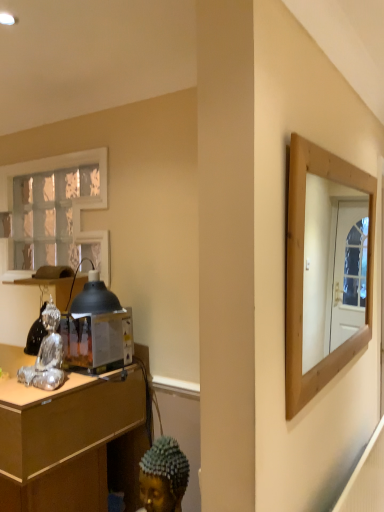
What do you see at coordinates (46, 355) in the screenshot? The height and width of the screenshot is (512, 384). I see `silver metallic figurine at left` at bounding box center [46, 355].

This screenshot has height=512, width=384. Describe the element at coordinates (73, 446) in the screenshot. I see `wooden desk at left` at that location.

This screenshot has height=512, width=384. In order to click on white textured glass at upper left in this screenshot , I will do pos(54,212).

Which is more to the left, white textured glass at upper left or silver metallic figurine at left?

From the viewer's perspective, white textured glass at upper left appears more on the left side.

Considering the positions of objects white textured glass at upper left and silver metallic figurine at left in the image provided, who is behind, white textured glass at upper left or silver metallic figurine at left?

Positioned behind is white textured glass at upper left.

How different are the orientations of white textured glass at upper left and silver metallic figurine at left in degrees?

The angle between the facing direction of white textured glass at upper left and the facing direction of silver metallic figurine at left is 1.42 degrees.

In the scene shown: Is white textured glass at upper left oriented away from silver metallic figurine at left?

No, white textured glass at upper left is not facing the opposite direction of silver metallic figurine at left.

From the image's perspective, is metallic/reflective toaster at left above or below silver metallic figurine at left?

metallic/reflective toaster at left is situated lower than silver metallic figurine at left in the image.

Considering the relative positions of metallic/reflective toaster at left and silver metallic figurine at left in the image provided, is metallic/reflective toaster at left to the left of silver metallic figurine at left from the viewer's perspective?

No.

Does metallic/reflective toaster at left have a lesser width compared to silver metallic figurine at left?

In fact, metallic/reflective toaster at left might be wider than silver metallic figurine at left.

Considering the points (61, 173) and (98, 429), which point is behind, point (61, 173) or point (98, 429)?

Positioned behind is point (61, 173).

Considering the sizes of objects white textured glass at upper left and wooden desk at left in the image provided, who is thinner, white textured glass at upper left or wooden desk at left?

white textured glass at upper left.

Can you see white textured glass at upper left touching wooden desk at left?

No, white textured glass at upper left is not making contact with wooden desk at left.

Is white textured glass at upper left facing towards wooden desk at left?

No.

From a real-world perspective, between metallic/reflective toaster at left and wooden desk at left, who is vertically lower?

wooden desk at left, from a real-world perspective.

Where is `desk in front of the metallic/reflective toaster at left`? This screenshot has width=384, height=512. desk in front of the metallic/reflective toaster at left is located at coordinates (73, 446).

Between metallic/reflective toaster at left and wooden desk at left, which one has larger size?

With larger size is wooden desk at left.

Is wooden desk at left at the back of metallic/reflective toaster at left?

No, metallic/reflective toaster at left is not facing the opposite direction of wooden desk at left.

Is wooden desk at left oriented away from metallic/reflective toaster at left?

No, wooden desk at left is not facing away from metallic/reflective toaster at left.

I want to click on appliance behind the wooden desk at left, so click(x=97, y=340).

From a real-world perspective, between wooden desk at left and metallic/reflective toaster at left, who is vertically lower?

wooden desk at left, from a real-world perspective.

Can we say wooden desk at left lies outside metallic/reflective toaster at left?

Absolutely, wooden desk at left is external to metallic/reflective toaster at left.

Where is `desk lying in front of the white textured glass at upper left`? desk lying in front of the white textured glass at upper left is located at coordinates (73, 446).

From a real-world perspective, is wooden desk at left over white textured glass at upper left?

No.

Is wooden desk at left far away from white textured glass at upper left?

No, wooden desk at left is not far from white textured glass at upper left.

From the image's perspective, is white textured glass at upper left above or below metallic/reflective toaster at left?

white textured glass at upper left is situated higher than metallic/reflective toaster at left in the image.

What's the angular difference between white textured glass at upper left and metallic/reflective toaster at left's facing directions?

There is a 1.71-degree angle between the facing directions of white textured glass at upper left and metallic/reflective toaster at left.

Is white textured glass at upper left directly adjacent to metallic/reflective toaster at left?

white textured glass at upper left is not next to metallic/reflective toaster at left, and they're not touching.

Is white textured glass at upper left smaller than metallic/reflective toaster at left?

No.

At what (x,y) coordinates should I click in order to perform the action: click on window lying behind the silver metallic figurine at left. Please return your answer as a coordinate pair (x, y). The height and width of the screenshot is (512, 384). Looking at the image, I should click on (54, 212).

You are a GUI agent. You are given a task and a screenshot of the screen. Output one action in this format:
    pyautogui.click(x=<x>, y=<y>)
    Task: Click on the figurine that is above the metallic/reflective toaster at left (from a real-world perspective)
    
    Given the screenshot: What is the action you would take?
    pyautogui.click(x=46, y=355)

Considering their positions, is metallic/reflective toaster at left positioned further to white textured glass at upper left than wooden desk at left?

Based on the image, wooden desk at left appears to be further to white textured glass at upper left.

Looking at the image, which one is located closer to silver metallic figurine at left, metallic/reflective toaster at left or white textured glass at upper left?

metallic/reflective toaster at left is positioned closer to the anchor silver metallic figurine at left.

Looking at the image, which one is located further to white textured glass at upper left, silver metallic figurine at left or metallic/reflective toaster at left?

silver metallic figurine at left lies further to white textured glass at upper left than the other object.

Estimate the real-world distances between objects in this image. Which object is further from silver metallic figurine at left, wooden desk at left or metallic/reflective toaster at left?

wooden desk at left is further to silver metallic figurine at left.

Estimate the real-world distances between objects in this image. Which object is closer to wooden desk at left, silver metallic figurine at left or white textured glass at upper left?

silver metallic figurine at left.

Looking at the image, which one is located further to wooden desk at left, metallic/reflective toaster at left or white textured glass at upper left?

white textured glass at upper left.

Estimate the real-world distances between objects in this image. Which object is closer to metallic/reflective toaster at left, silver metallic figurine at left or wooden desk at left?

silver metallic figurine at left is closer to metallic/reflective toaster at left.

Based on their spatial positions, is white textured glass at upper left or wooden desk at left closer to silver metallic figurine at left?

wooden desk at left lies closer to silver metallic figurine at left than the other object.

The image size is (384, 512). I want to click on figurine between white textured glass at upper left and metallic/reflective toaster at left vertically, so click(x=46, y=355).

Image resolution: width=384 pixels, height=512 pixels. Identify the location of figurine between white textured glass at upper left and wooden desk at left from top to bottom. (46, 355).

This screenshot has width=384, height=512. I want to click on figurine located between wooden desk at left and metallic/reflective toaster at left in the left-right direction, so click(x=46, y=355).

The height and width of the screenshot is (512, 384). I want to click on appliance between white textured glass at upper left and wooden desk at left in the vertical direction, so 97,340.